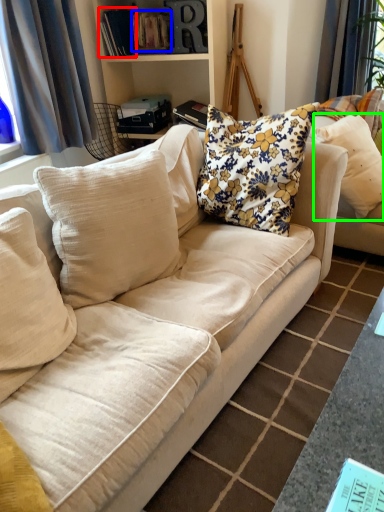
Question: Estimate the real-world distances between objects in this image. Which object is closer to book (highlighted by a red box), book (highlighted by a blue box) or pillow (highlighted by a green box)?

Choices:
 (A) book
 (B) pillow

Answer: (A)